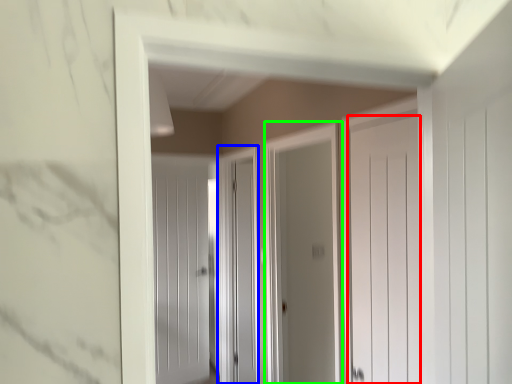
Question: Estimate the real-world distances between objects in this image. Which object is farther from door (highlighted by a red box), screen door (highlighted by a blue box) or screen door (highlighted by a green box)?

Choices:
 (A) screen door
 (B) screen door

Answer: (A)